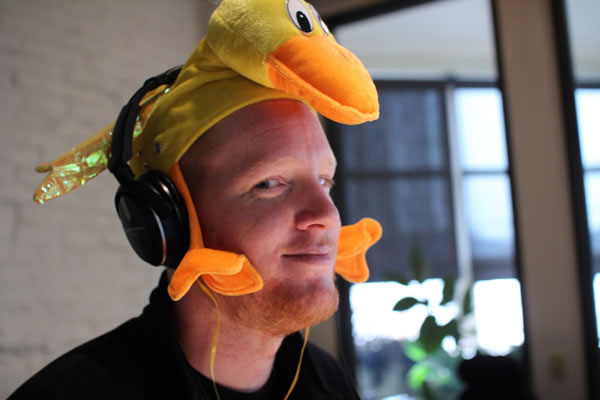
At what (x,y) coordinates should I click in order to perform the action: click on light tan brick wall. Please return your answer as a coordinate pair (x, y). Looking at the image, I should click on (68, 269).